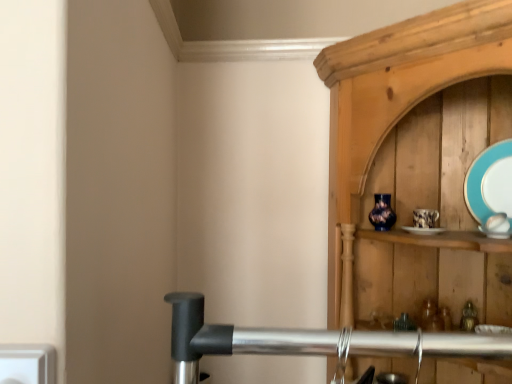
Question: From a real-world perspective, is teal glossy plate at upper right positioned above or below white plastic electric outlet at lower left?

Choices:
 (A) below
 (B) above

Answer: (B)

Question: Is teal glossy plate at upper right bigger or smaller than white plastic electric outlet at lower left?

Choices:
 (A) big
 (B) small

Answer: (A)

Question: From the image's perspective, is teal glossy plate at upper right above or below white plastic electric outlet at lower left?

Choices:
 (A) below
 (B) above

Answer: (B)

Question: In terms of width, does white plastic electric outlet at lower left look wider or thinner when compared to teal glossy plate at upper right?

Choices:
 (A) wide
 (B) thin

Answer: (A)

Question: From a real-world perspective, is white plastic electric outlet at lower left positioned above or below teal glossy plate at upper right?

Choices:
 (A) below
 (B) above

Answer: (A)

Question: In terms of size, does white plastic electric outlet at lower left appear bigger or smaller than teal glossy plate at upper right?

Choices:
 (A) small
 (B) big

Answer: (A)

Question: From the image's perspective, is white plastic electric outlet at lower left located above or below teal glossy plate at upper right?

Choices:
 (A) above
 (B) below

Answer: (B)